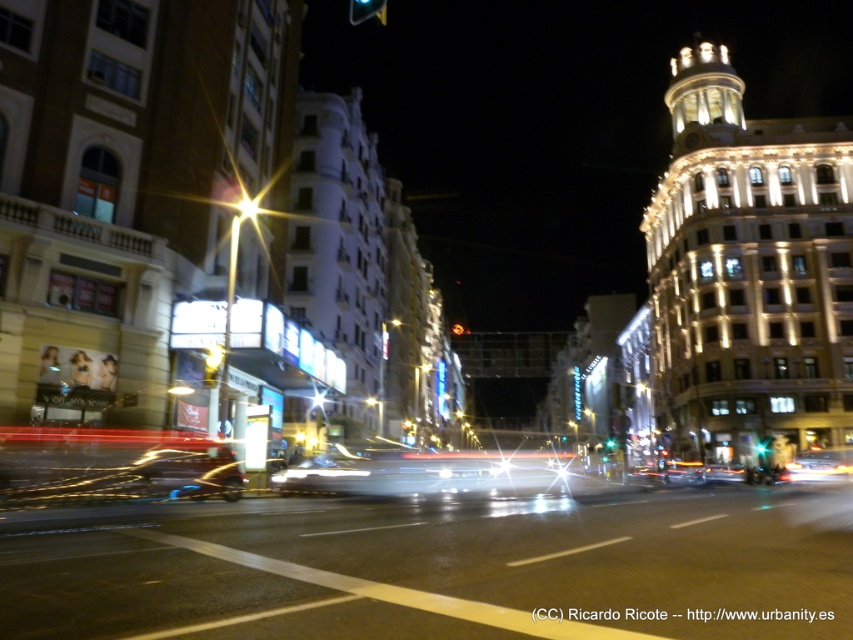
Does amber glass traffic light at upper center have a greater width compared to bright metallic streetlight at upper center?

Indeed, amber glass traffic light at upper center has a greater width compared to bright metallic streetlight at upper center.

Between point (370, 10) and point (241, 205), which one is positioned behind?

Positioned behind is point (241, 205).

Which is in front, point (349, 3) or point (248, 196)?

Point (248, 196)

The width and height of the screenshot is (853, 640). Identify the location of amber glass traffic light at upper center. (366, 10).

Based on the photo, is bright metallic streetlight at upper center taller than green glass traffic light at center?

Incorrect, bright metallic streetlight at upper center's height is not larger of green glass traffic light at center's.

Is bright metallic streetlight at upper center positioned behind green glass traffic light at center?

No, it is not.

Identify the location of bright metallic streetlight at upper center. click(x=247, y=205).

Who is positioned more to the left, metallic silver car at lower left or amber glass traffic light at upper center?

Positioned to the left is amber glass traffic light at upper center.

Is metallic silver car at lower left thinner than amber glass traffic light at upper center?

Yes.

This screenshot has height=640, width=853. I want to click on metallic silver car at lower left, so click(112, 465).

Locate an element on the screen. The width and height of the screenshot is (853, 640). metallic silver car at lower left is located at coordinates (112, 465).